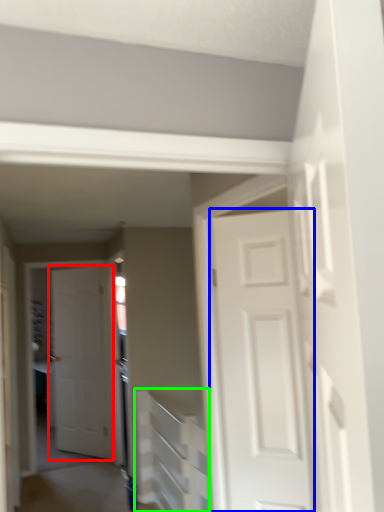
Question: Considering the real-world distances, which object is closest to door (highlighted by a red box)? door (highlighted by a blue box) or stairwell (highlighted by a green box).

Choices:
 (A) door
 (B) stairwell

Answer: (B)